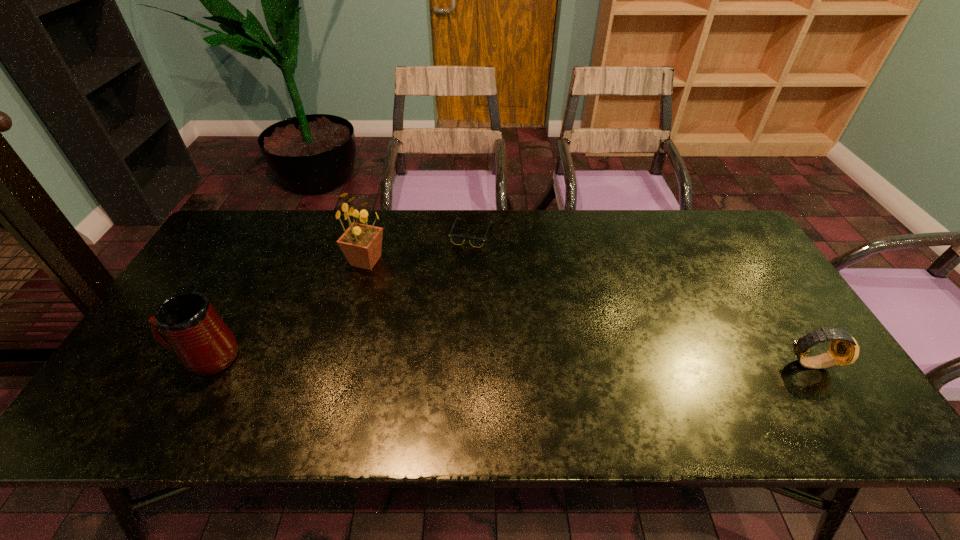
Where is `empty location between the sunflower and the mug`? The image size is (960, 540). empty location between the sunflower and the mug is located at coordinates (286, 309).

At what (x,y) coordinates should I click in order to perform the action: click on vacant region between the tallest object and the watch. Please return your answer as a coordinate pair (x, y). Looking at the image, I should click on (588, 312).

The width and height of the screenshot is (960, 540). Identify the location of blank region between the second shortest object and the mug. (508, 360).

Where is `vacant space that is in between the watch and the shortest object`? The image size is (960, 540). vacant space that is in between the watch and the shortest object is located at coordinates (640, 298).

Where is `empty location between the third object from right to left and the sunglasses`? empty location between the third object from right to left and the sunglasses is located at coordinates (419, 247).

Identify the location of free point between the leftmost object and the tallest object. This screenshot has height=540, width=960. (286, 309).

Locate an element on the screen. vacant space that's between the sunflower and the leftmost object is located at coordinates (286, 309).

The width and height of the screenshot is (960, 540). I want to click on the second closest object to the leftmost object, so click(x=456, y=239).

Select which object appears as the third closest to the third object from right to left. Please provide its 2D coordinates. Your answer should be formatted as a tuple, i.e. [(x, y)], where the tuple contains the x and y coordinates of a point satisfying the conditions above.

[(844, 350)]

At what (x,y) coordinates should I click in order to perform the action: click on free space that satisfies the following two spatial constraints: 1. on the front side of the tallest object; 2. on the face of the watch. Please return your answer as a coordinate pair (x, y). Looking at the image, I should click on (339, 363).